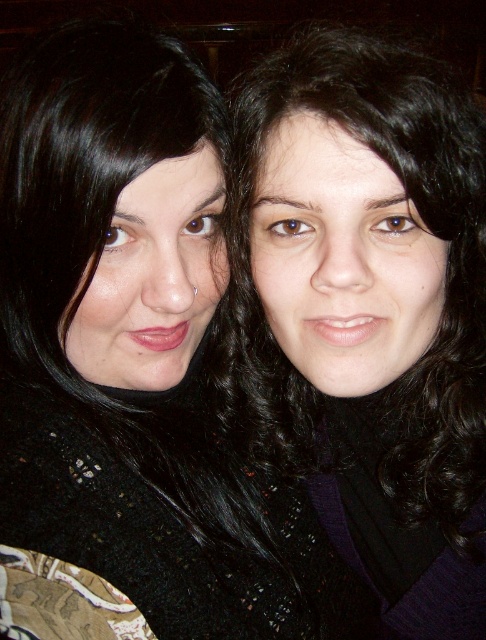
Can you confirm if black matte hair at center is thinner than black curly hair at upper right?

In fact, black matte hair at center might be wider than black curly hair at upper right.

I want to click on black matte hair at center, so click(134, 368).